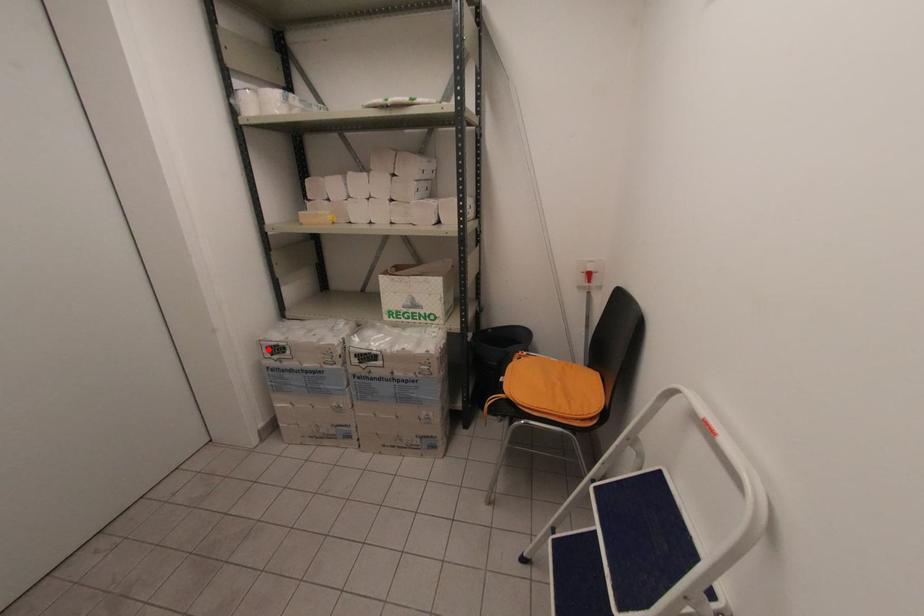
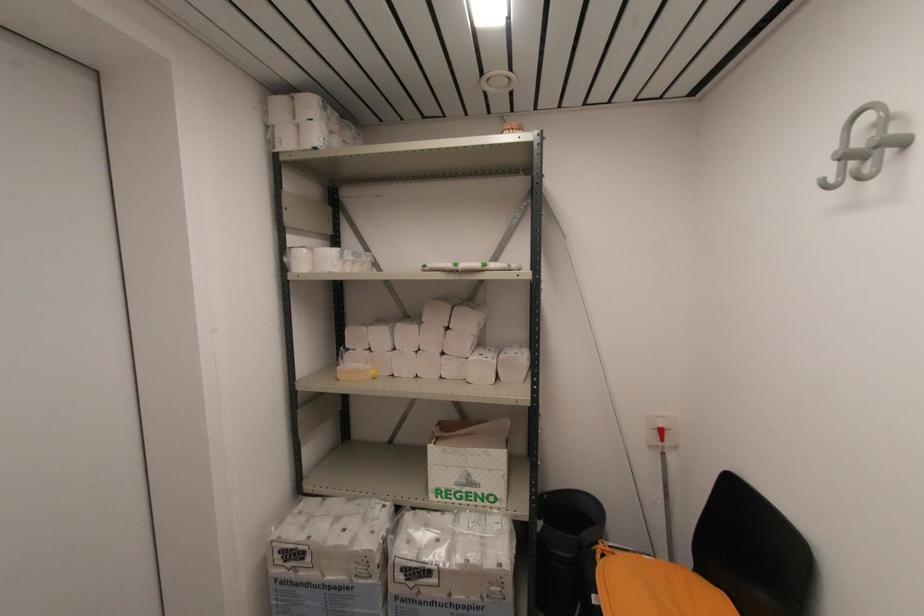
In the second image, find the point that corresponds to the highlighted location in the first image.

(281, 553)